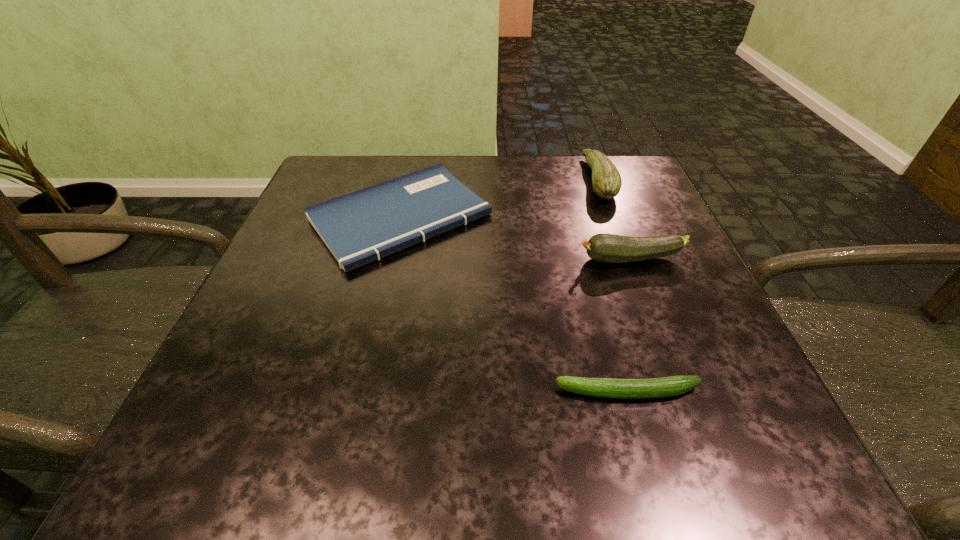
Image resolution: width=960 pixels, height=540 pixels. In order to click on vacant space located 0.150m at the blossom end of the second nearest zucchini in this screenshot , I will do point(495,259).

The width and height of the screenshot is (960, 540). Identify the location of free point located on the back of the paperback book. (413, 162).

At what (x,y) coordinates should I click in order to perform the action: click on vacant space located 0.060m on the front-facing side of the shortest zucchini. Please return your answer as a coordinate pair (x, y). Looking at the image, I should click on point(513,392).

In order to click on vacant space located 0.140m on the front-facing side of the shortest zucchini in this screenshot , I will do `click(455, 392)`.

This screenshot has height=540, width=960. In order to click on vacant area situated on the front-facing side of the shortest zucchini in this screenshot , I will do `click(492, 392)`.

Locate an element on the screen. zucchini located at the far edge is located at coordinates (606, 180).

Where is `paperback book that is positioned at the far edge`? The width and height of the screenshot is (960, 540). paperback book that is positioned at the far edge is located at coordinates (363, 226).

This screenshot has height=540, width=960. I want to click on object located at the left edge, so click(363, 226).

Where is `object at the far left corner`? Image resolution: width=960 pixels, height=540 pixels. object at the far left corner is located at coordinates (363, 226).

Locate an element on the screen. The image size is (960, 540). object located at the far right corner is located at coordinates (606, 180).